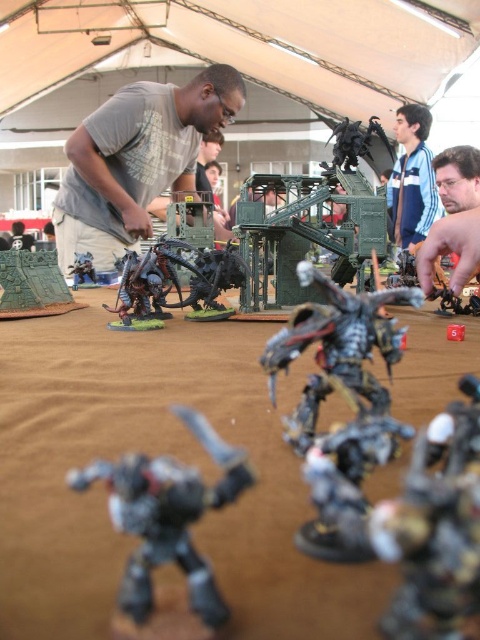
You are a player in a tabletop game and need to determine if your shiny metallic robot at center can be seen over the blue striped shirt at upper center. Based on their heights, can the robot be seen from behind the shirt?

The shiny metallic robot at center is shorter than the blue striped shirt at upper center, so it cannot be seen from behind the shirt.

You are a player standing at the edge of the table, and you want to reach the gray matte shirt at center to adjust its position. Can you estimate whether you can comfortably reach it without moving your chair?

The gray matte shirt at center is 6.85 feet away from you, so you cannot comfortably reach it without moving your chair since the typical arm reach is about 2 feet.

You are a player in a tabletop game and need to place your miniature figure on the green plastic terrain at left. What are the coordinates where you should place it?

The green plastic terrain at left is located at coordinates point (x=33, y=285).